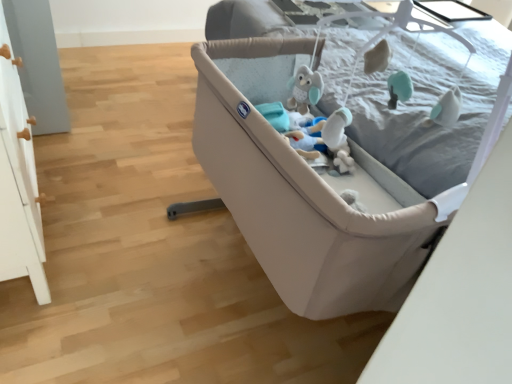
Question: From a real-world perspective, is beige fabric crib at center positioned over soft gray fabric mattress at upper right based on gravity?

Choices:
 (A) no
 (B) yes

Answer: (A)

Question: Considering the relative sizes of beige fabric crib at center and soft gray fabric mattress at upper right in the image provided, is beige fabric crib at center shorter than soft gray fabric mattress at upper right?

Choices:
 (A) no
 (B) yes

Answer: (A)

Question: Is beige fabric crib at center at the right side of soft gray fabric mattress at upper right?

Choices:
 (A) no
 (B) yes

Answer: (A)

Question: From the image's perspective, is beige fabric crib at center below soft gray fabric mattress at upper right?

Choices:
 (A) no
 (B) yes

Answer: (B)

Question: Considering the relative sizes of beige fabric crib at center and soft gray fabric mattress at upper right in the image provided, is beige fabric crib at center thinner than soft gray fabric mattress at upper right?

Choices:
 (A) no
 (B) yes

Answer: (A)

Question: Relative to soft gray fabric mattress at upper right, is white plush toy at center in front or behind?

Choices:
 (A) behind
 (B) front

Answer: (A)

Question: From their relative heights in the image, would you say white plush toy at center is taller or shorter than soft gray fabric mattress at upper right?

Choices:
 (A) tall
 (B) short

Answer: (B)

Question: Is point (334, 140) closer or farther from the camera than point (487, 36)?

Choices:
 (A) closer
 (B) farther

Answer: (A)

Question: From the image's perspective, is white plush toy at center above or below soft gray fabric mattress at upper right?

Choices:
 (A) above
 (B) below

Answer: (B)

Question: In terms of size, does white plush toy at center appear bigger or smaller than beige fabric crib at center?

Choices:
 (A) big
 (B) small

Answer: (B)

Question: From the image's perspective, is white plush toy at center located above or below beige fabric crib at center?

Choices:
 (A) above
 (B) below

Answer: (A)

Question: Is white plush toy at center wider or thinner than beige fabric crib at center?

Choices:
 (A) wide
 (B) thin

Answer: (B)

Question: Considering the relative positions of white plush toy at center and beige fabric crib at center in the image provided, is white plush toy at center to the left or to the right of beige fabric crib at center?

Choices:
 (A) right
 (B) left

Answer: (A)

Question: In terms of size, does soft gray fabric mattress at upper right appear bigger or smaller than white plush toy at center?

Choices:
 (A) big
 (B) small

Answer: (A)

Question: Considering the positions of soft gray fabric mattress at upper right and white plush toy at center in the image, is soft gray fabric mattress at upper right taller or shorter than white plush toy at center?

Choices:
 (A) short
 (B) tall

Answer: (B)